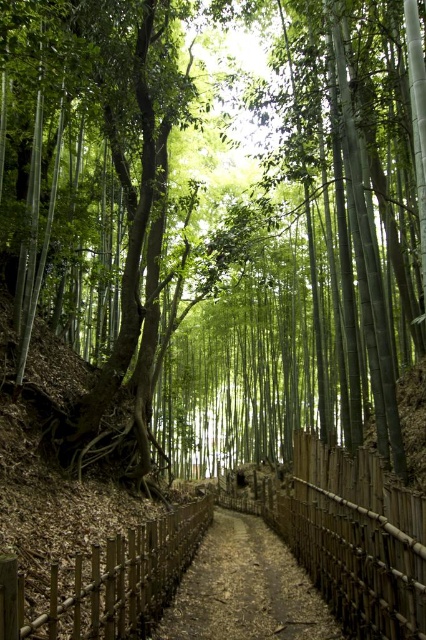
Locate an element on the screen. bamboo fence at center is located at coordinates (356, 538).

In the scene shown: Between bamboo fence at center and wooden fence at center, which one is positioned higher?

bamboo fence at center is higher up.

Which is behind, point (333, 460) or point (75, 598)?

Positioned behind is point (333, 460).

Locate an element on the screen. The width and height of the screenshot is (426, 640). bamboo fence at center is located at coordinates (356, 538).

Is bamboo fence at center wider than brown wooden trail at center?

Incorrect, bamboo fence at center's width does not surpass brown wooden trail at center's.

Which is behind, point (399, 589) or point (317, 605)?

The point (317, 605) is behind.

Looking at this image, measure the distance between point [342,582] and camera.

A distance of 20.12 feet exists between point [342,582] and camera.

Locate an element on the screen. bamboo fence at center is located at coordinates (356, 538).

Who is shorter, wooden fence at center or brown wooden trail at center?

brown wooden trail at center

Based on the photo, who is more distant from viewer, (97, 563) or (316, 625)?

Positioned behind is point (316, 625).

The height and width of the screenshot is (640, 426). I want to click on wooden fence at center, so click(109, 580).